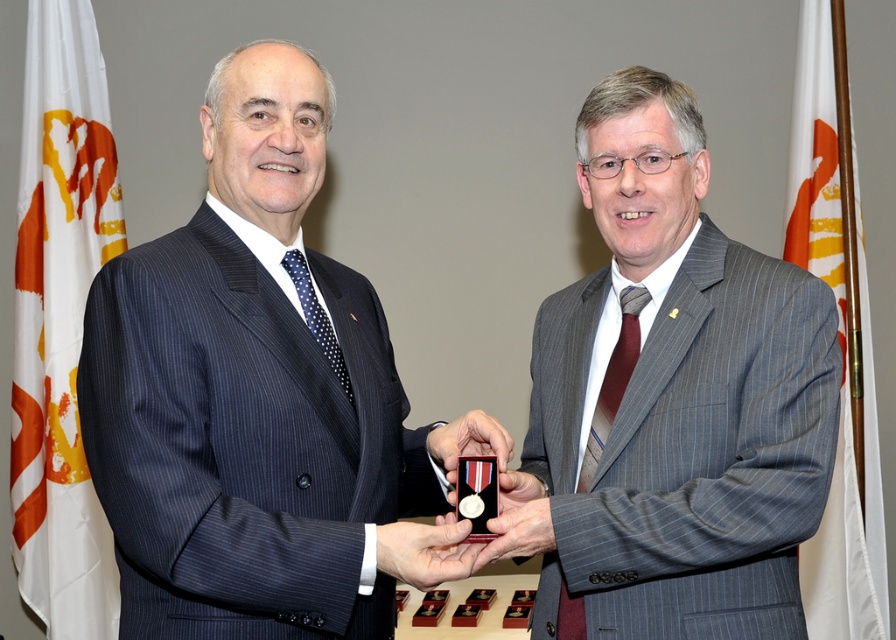
Is metallic red box at center smaller than metallic medal at center?

Incorrect, metallic red box at center is not smaller in size than metallic medal at center.

Is point (453, 536) closer to viewer compared to point (452, 461)?

Yes, point (453, 536) is closer to viewer.

At what (x,y) coordinates should I click in order to perform the action: click on metallic red box at center. Please return your answer as a coordinate pair (x, y). Looking at the image, I should click on (425, 550).

The width and height of the screenshot is (896, 640). Describe the element at coordinates (59, 321) in the screenshot. I see `white fabric flag at left` at that location.

Is white fabric flag at left above white fabric flag at right?

Yes, white fabric flag at left is above white fabric flag at right.

Measure the distance between point (10, 499) and camera.

Point (10, 499) is 9.66 feet from camera.

Locate an element on the screen. This screenshot has width=896, height=640. white fabric flag at left is located at coordinates (59, 321).

Can you confirm if gray pinstripe suit at center is thinner than metallic red box at center?

In fact, gray pinstripe suit at center might be wider than metallic red box at center.

Is point (592, 595) farther from viewer compared to point (415, 536)?

Yes, it is behind point (415, 536).

The image size is (896, 640). I want to click on gray pinstripe suit at center, so click(x=674, y=397).